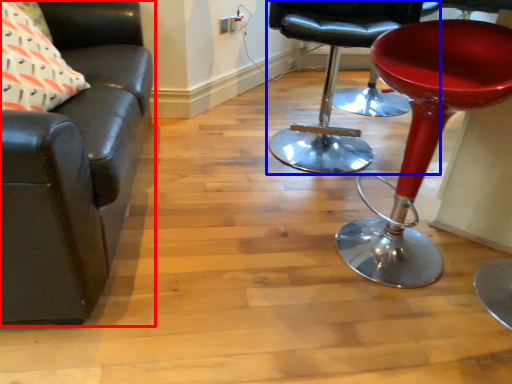
Question: Among these objects, which one is nearest to the camera, chair (highlighted by a red box) or chair (highlighted by a blue box)?

Choices:
 (A) chair
 (B) chair

Answer: (A)